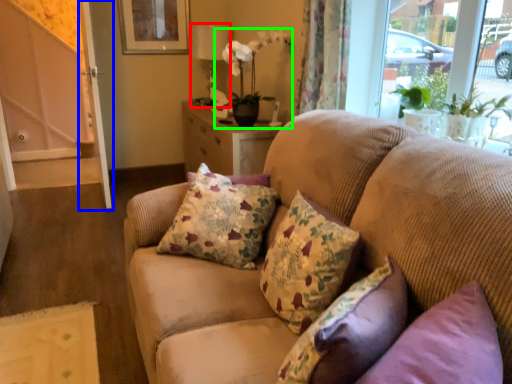
Question: Estimate the real-world distances between objects in this image. Which object is farther from lamp (highlighted by a red box), screen door (highlighted by a blue box) or houseplant (highlighted by a green box)?

Choices:
 (A) screen door
 (B) houseplant

Answer: (A)